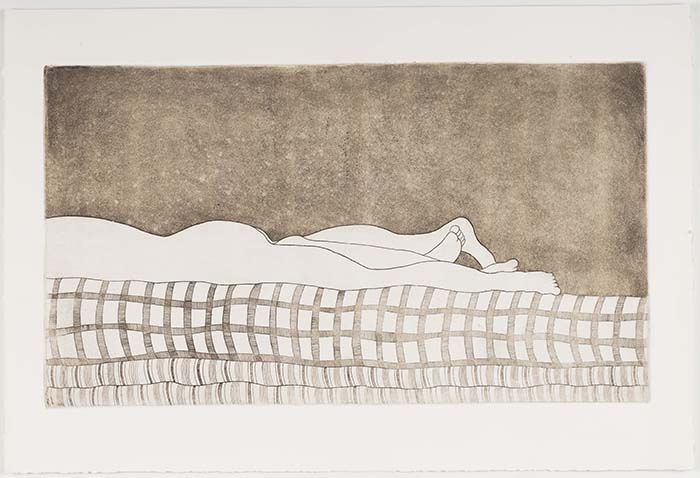
At what (x,y) coordinates should I click in order to perform the action: click on dark purple wall. Please return your answer as a coordinate pair (x, y). Image resolution: width=700 pixels, height=478 pixels. Looking at the image, I should click on (204, 145).